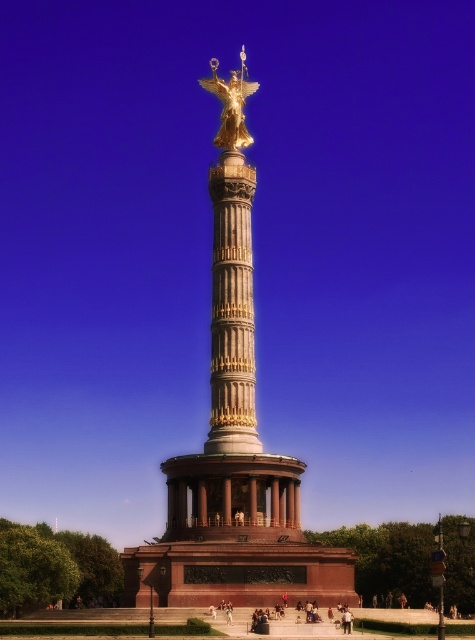
You are a tourist standing at the base of the monument. You see the gold metallic statue at upper center and the golden statue at center. Which one is higher up?

The gold metallic statue at upper center is higher up than the golden statue at center because it is located above it.

You are a drone operator tasked with capturing aerial footage of the monument. Your drone has a maximum flight range of 60 meters. You need to fly from the gold metallic statue at upper center to the golden statue at center. Can your drone complete this flight without exceeding its range?

The distance between the gold metallic statue at upper center and the golden statue at center is 59.86 meters, which is within the drone operator drone maximum flight range of 60 meters. Yes, the drone can complete this flight without exceeding its range.